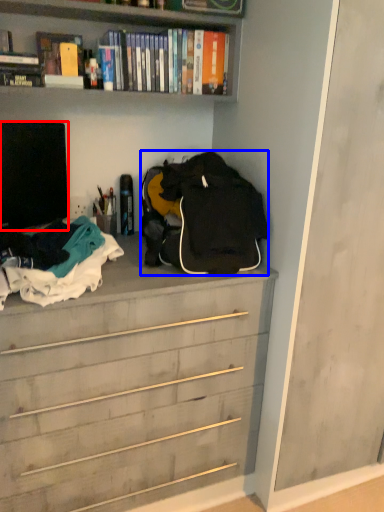
Question: Which of the following is the farthest to the observer, television (highlighted by a red box) or backpack (highlighted by a blue box)?

Choices:
 (A) television
 (B) backpack

Answer: (A)